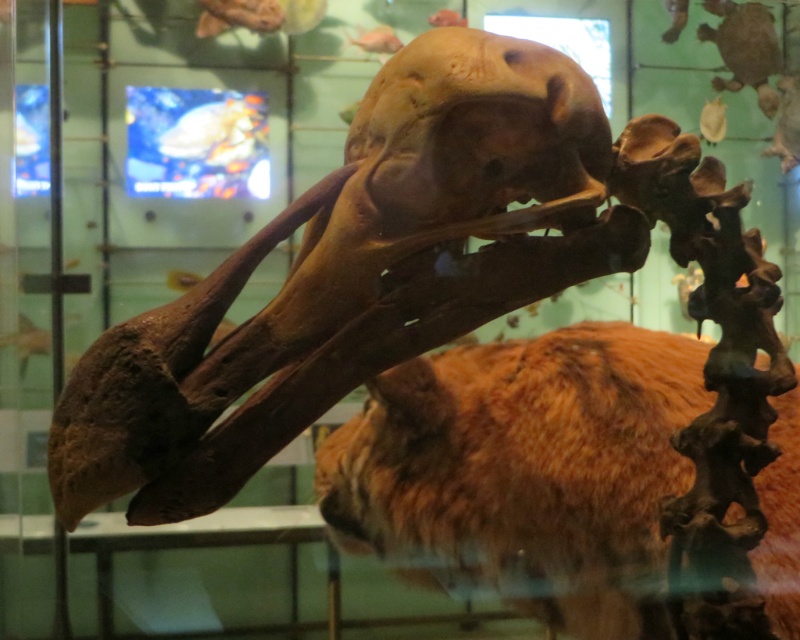
At what (x,y) coordinates should I click in order to perform the action: click on brown matte skull at center. Please return your answer as a coordinate pair (x, y). The image size is (800, 640). Looking at the image, I should click on (354, 275).

Is brown matte skull at center positioned at the back of brown fuzzy fur at center?

That is False.

Does point (96, 442) lie behind point (405, 467)?

No, (96, 442) is closer to viewer.

Locate an element on the screen. Image resolution: width=800 pixels, height=640 pixels. brown matte skull at center is located at coordinates (354, 275).

Who is higher up, brown fuzzy fur at center or brown matte skull at upper center?

Positioned higher is brown matte skull at upper center.

Is point (605, 486) behind point (384, 83)?

Yes, point (605, 486) is farther from viewer.

Identify the location of brown fuzzy fur at center. (524, 472).

The height and width of the screenshot is (640, 800). What are the coordinates of `brown fuzzy fur at center` in the screenshot? It's located at (524, 472).

Can you confirm if brown matte skull at center is bigger than brown matte skull at upper center?

Indeed, brown matte skull at center has a larger size compared to brown matte skull at upper center.

Does brown matte skull at center have a greater width compared to brown matte skull at upper center?

Yes.

Between point (220, 291) and point (524, 51), which one is positioned behind?

Point (524, 51)

Locate an element on the screen. The height and width of the screenshot is (640, 800). brown matte skull at center is located at coordinates click(x=354, y=275).